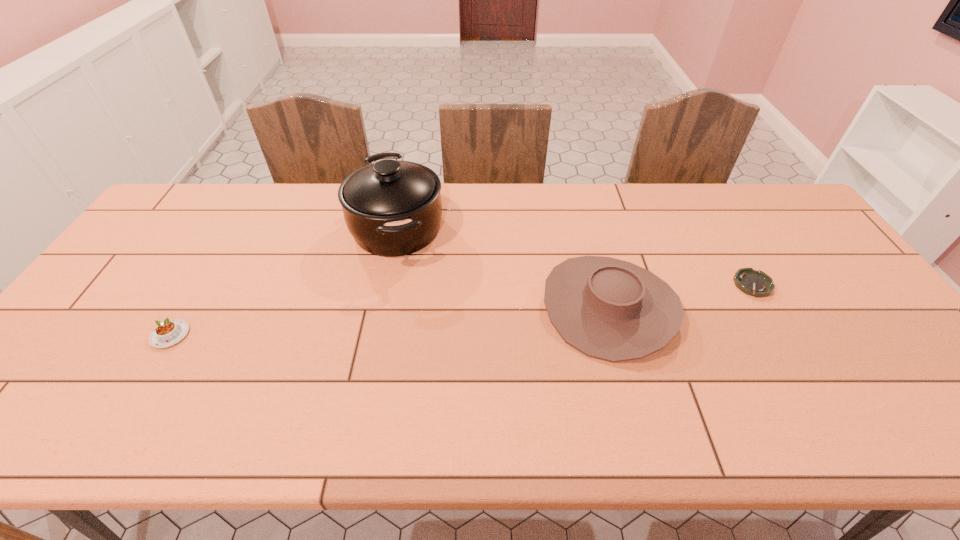
Image resolution: width=960 pixels, height=540 pixels. What are the coordinates of `vacant region located on the right of the leftmost object` in the screenshot? It's located at (332, 335).

At what (x,y) coordinates should I click in order to perform the action: click on vacant area situated 0.050m on the back of the ashtray. Please return your answer as a coordinate pair (x, y). Looking at the image, I should click on (738, 259).

The width and height of the screenshot is (960, 540). Find the location of `object located in the far edge section of the desktop`. object located in the far edge section of the desktop is located at coordinates [x=392, y=208].

This screenshot has width=960, height=540. In the image, there is a desktop. Identify the location of vacant space at the far edge. (503, 200).

The width and height of the screenshot is (960, 540). In the image, there is a desktop. Find the location of `free region at the near edge`. free region at the near edge is located at coordinates (706, 435).

This screenshot has height=540, width=960. In the image, there is a desktop. In order to click on vacant space at the right edge in this screenshot , I will do `click(792, 244)`.

The height and width of the screenshot is (540, 960). I want to click on free location at the near right corner of the desktop, so click(x=895, y=409).

Locate an element on the screen. This screenshot has width=960, height=540. free area in between the cowboy hat and the tallest object is located at coordinates (503, 268).

Where is `free space between the ashtray and the leftmost object`? This screenshot has width=960, height=540. free space between the ashtray and the leftmost object is located at coordinates (462, 309).

You are a GUI agent. You are given a task and a screenshot of the screen. Output one action in this format:
    pyautogui.click(x=<x>, y=<y>)
    Task: Click on the free space between the cowboy hat and the rightmost object
    The height and width of the screenshot is (540, 960).
    Given the screenshot: What is the action you would take?
    pyautogui.click(x=681, y=296)